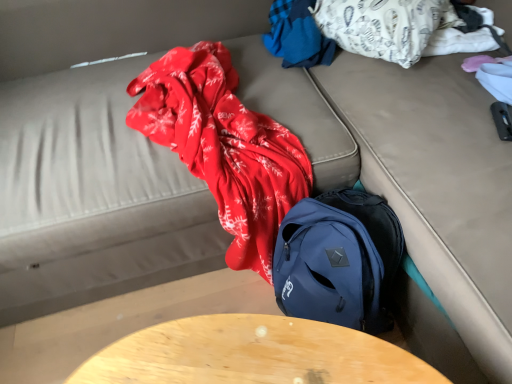
Where is `free space above wooden table at center (from a real-world perspective)`? Image resolution: width=512 pixels, height=384 pixels. free space above wooden table at center (from a real-world perspective) is located at coordinates (247, 355).